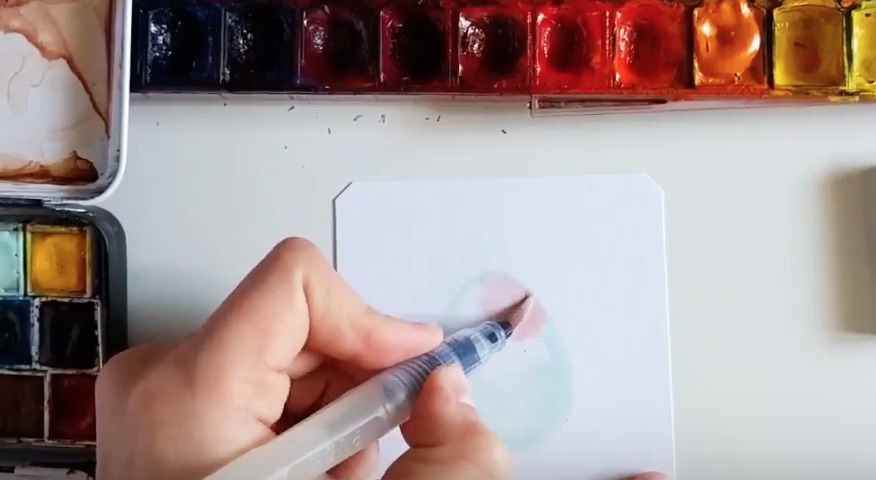
Locate an element on the screen. dark maroon paint is located at coordinates (343, 46).